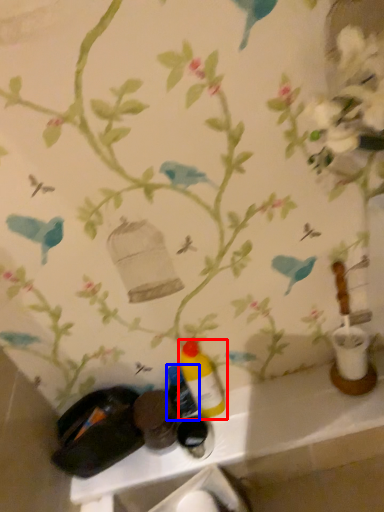
Question: Which object appears closest to the camera in this image, bottle (highlighted by a red box) or bottle (highlighted by a blue box)?

Choices:
 (A) bottle
 (B) bottle

Answer: (A)